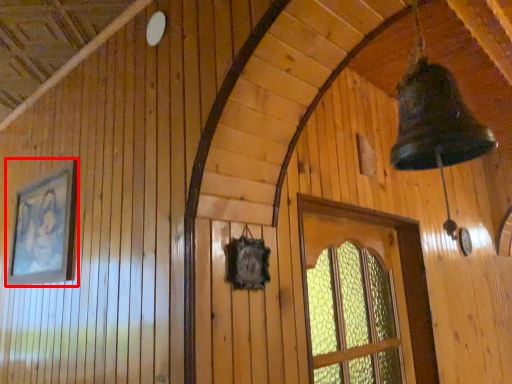
Question: Considering the relative positions of picture frame (annotated by the red box) and window in the image provided, where is picture frame (annotated by the red box) located with respect to the staircase?

Choices:
 (A) right
 (B) left

Answer: (B)